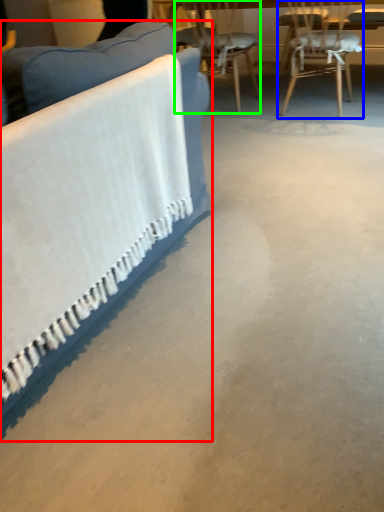
Question: Which object is positioned farthest from studio couch (highlighted by a red box)? Select from chair (highlighted by a blue box) and chair (highlighted by a green box).

Choices:
 (A) chair
 (B) chair

Answer: (B)